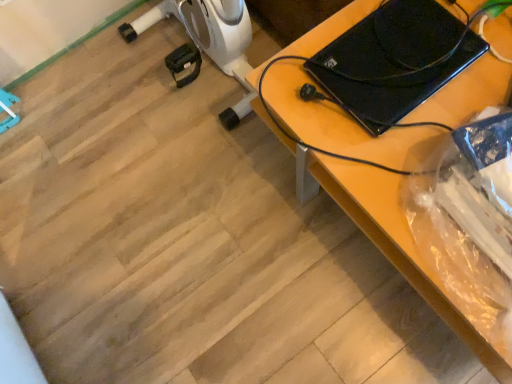
The image size is (512, 384). Find the location of `free point to the right of black glossy laptop at upper right`. free point to the right of black glossy laptop at upper right is located at coordinates (473, 47).